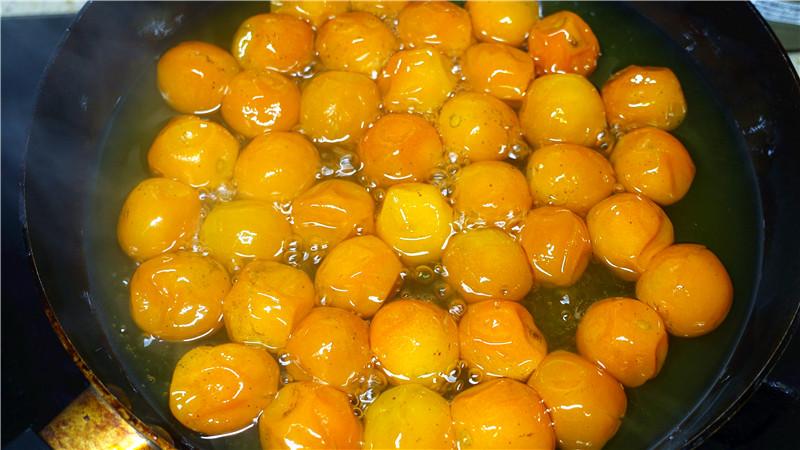
Locate an element on the screen. black skillet is located at coordinates (66, 228).